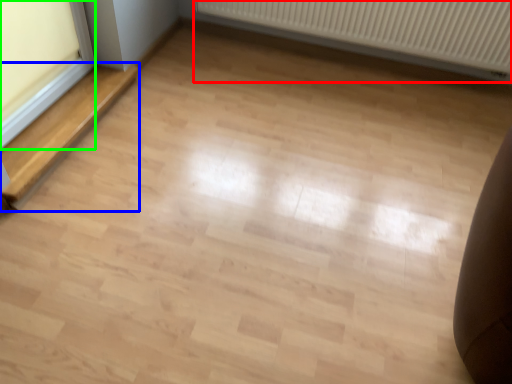
Question: Which object is the closest to the radiator (highlighted by a red box)? Choose among these: stairwell (highlighted by a blue box) or window frame (highlighted by a green box).

Choices:
 (A) stairwell
 (B) window frame

Answer: (A)